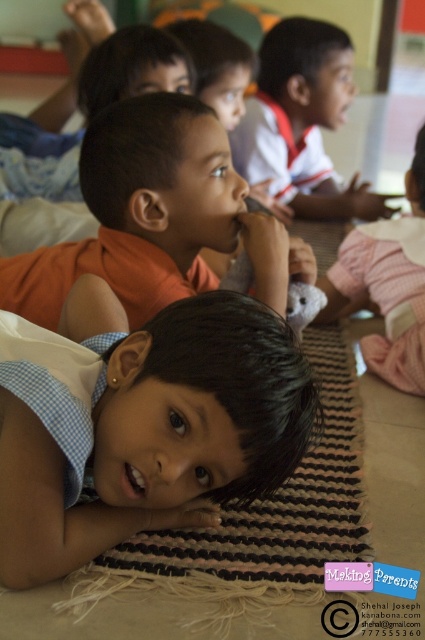
Question: Does orange matte shirt at center have a lesser width compared to white glossy shirt at upper center?

Choices:
 (A) yes
 (B) no

Answer: (A)

Question: Can you confirm if blue checkered shirt at lower left is thinner than white glossy shirt at upper center?

Choices:
 (A) yes
 (B) no

Answer: (A)

Question: Is the position of orange matte shirt at center more distant than that of white glossy shirt at upper center?

Choices:
 (A) no
 (B) yes

Answer: (A)

Question: Considering the real-world distances, which object is farthest from the pink checkered shirt at lower right?

Choices:
 (A) orange matte shirt at center
 (B) white glossy shirt at upper center

Answer: (B)

Question: Which is nearer to the orange matte shirt at center?

Choices:
 (A) pink checkered shirt at lower right
 (B) white glossy shirt at upper center

Answer: (A)

Question: Which of these objects is positioned closest to the orange matte shirt at center?

Choices:
 (A) blue checkered shirt at lower left
 (B) white glossy shirt at upper center

Answer: (A)